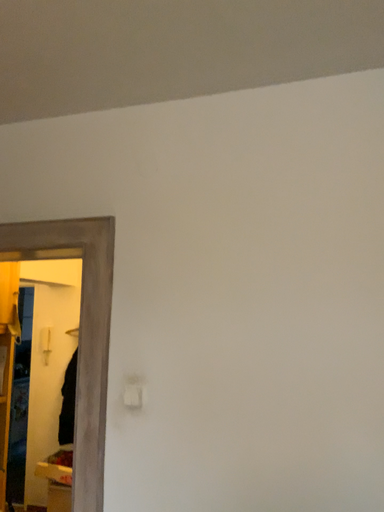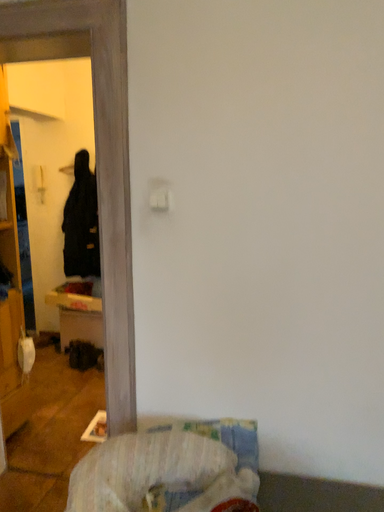
Question: How did the camera likely rotate when shooting the video?

Choices:
 (A) rotated upward
 (B) rotated downward

Answer: (B)